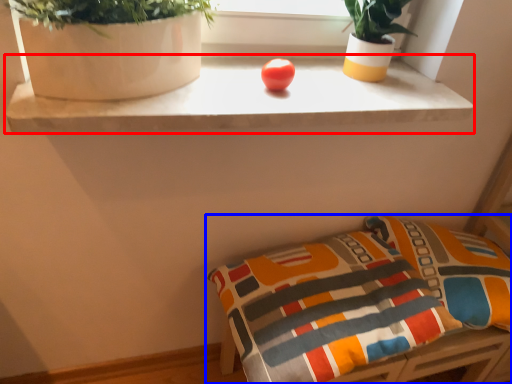
Question: Which object is closer to the camera taking this photo, table (highlighted by a red box) or furniture (highlighted by a blue box)?

Choices:
 (A) table
 (B) furniture

Answer: (A)